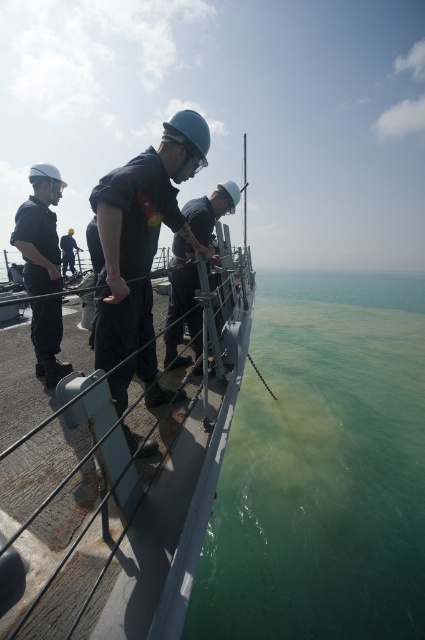
Question: Does green murky water at lower center lie behind black matte helmet at center?

Choices:
 (A) yes
 (B) no

Answer: (A)

Question: Which of the following is the closest to the observer?

Choices:
 (A) (73, 257)
 (B) (184, 216)
 (C) (146, 268)

Answer: (C)

Question: Is metallic gray boat at center positioned before dark blue uniform at center?

Choices:
 (A) yes
 (B) no

Answer: (A)

Question: Can you confirm if green murky water at lower center is positioned to the right of matte black uniform at left?

Choices:
 (A) no
 (B) yes

Answer: (B)

Question: Which object is farther from the camera taking this photo?

Choices:
 (A) matte black uniform at left
 (B) metallic gray boat at center

Answer: (A)

Question: Which object is the farthest from the green murky water at lower center?

Choices:
 (A) dark blue uniform at center
 (B) black matte helmet at center
 (C) metallic gray boat at center
 (D) matte black uniform at left

Answer: (A)